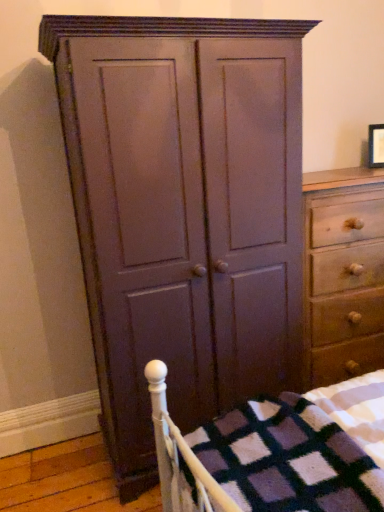
Question: From their relative heights in the image, would you say light brown wood chest of drawers at right is taller or shorter than matte black picture frame at upper right?

Choices:
 (A) short
 (B) tall

Answer: (B)

Question: In terms of size, does light brown wood chest of drawers at right appear bigger or smaller than matte black picture frame at upper right?

Choices:
 (A) small
 (B) big

Answer: (B)

Question: Which object is positioned farthest from the light brown wood chest of drawers at right?

Choices:
 (A) matte wood cupboard at center
 (B) matte black picture frame at upper right

Answer: (B)

Question: Which object is positioned closest to the matte wood cupboard at center?

Choices:
 (A) matte black picture frame at upper right
 (B) light brown wood chest of drawers at right

Answer: (B)